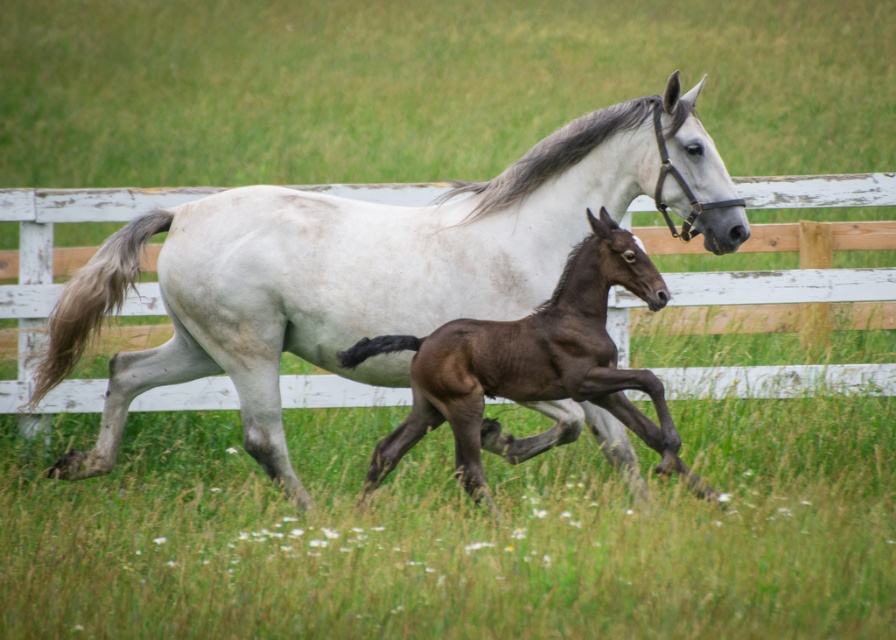
Question: Where is white glossy horse at center located in relation to shiny brown foal at center in the image?

Choices:
 (A) left
 (B) right

Answer: (A)

Question: Which of the following is the closest to the observer?

Choices:
 (A) (395, 266)
 (B) (412, 381)

Answer: (B)

Question: Can you confirm if white glossy horse at center is positioned below shiny brown foal at center?

Choices:
 (A) yes
 (B) no

Answer: (B)

Question: Is white glossy horse at center smaller than shiny brown foal at center?

Choices:
 (A) yes
 (B) no

Answer: (B)

Question: Which of the following is the closest to the observer?

Choices:
 (A) (264, 321)
 (B) (591, 371)

Answer: (B)